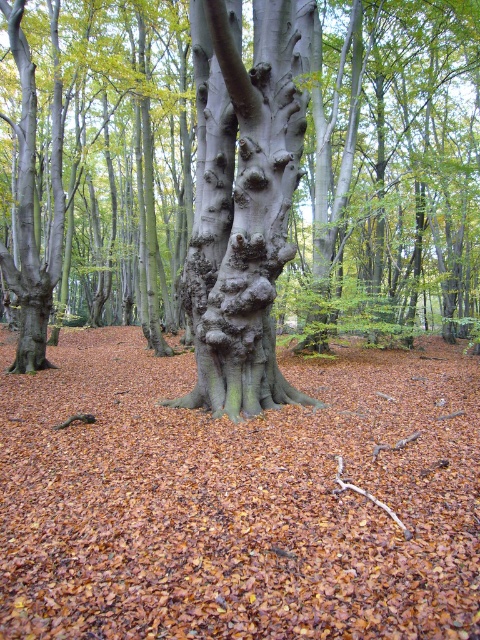
Question: Which object appears closest to the camera in this image?

Choices:
 (A) smooth gray tree trunk at center
 (B) smooth gray bark at center
 (C) brown matte tree trunk at center

Answer: (C)

Question: Estimate the real-world distances between objects in this image. Which object is farther from the brown matte tree trunk at center?

Choices:
 (A) smooth gray tree trunk at center
 (B) smooth gray bark at center

Answer: (A)

Question: Is brown matte tree trunk at center smaller than smooth gray bark at center?

Choices:
 (A) yes
 (B) no

Answer: (B)

Question: Estimate the real-world distances between objects in this image. Which object is closer to the smooth gray tree trunk at center?

Choices:
 (A) brown matte tree trunk at center
 (B) smooth gray bark at center

Answer: (A)

Question: Does smooth gray tree trunk at center lie in front of smooth gray bark at center?

Choices:
 (A) yes
 (B) no

Answer: (B)

Question: Does brown matte tree trunk at center appear on the left side of smooth gray tree trunk at center?

Choices:
 (A) no
 (B) yes

Answer: (A)